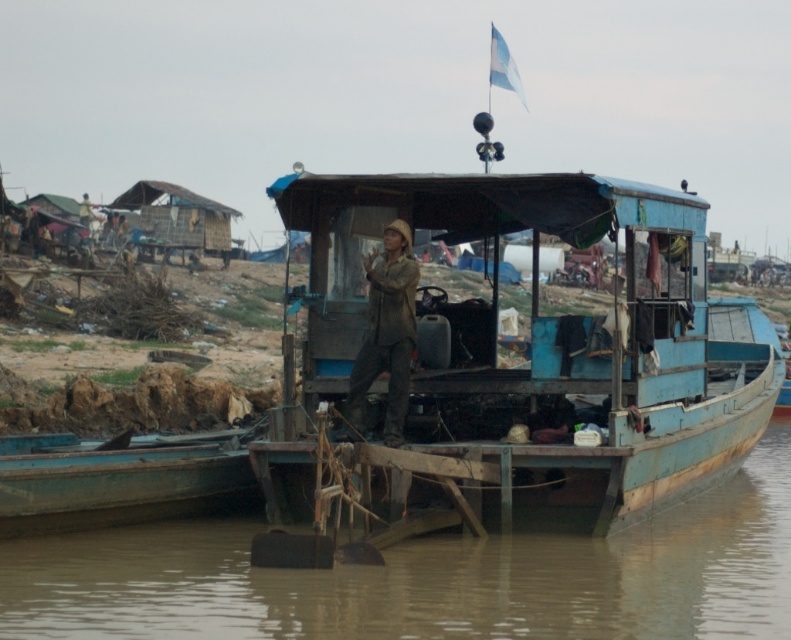
You are navigating a small boat along the river and want to reach the point marked at coordinates (x=430, y=579). Based on the scene, can you determine if this point is located on the brown wooden river at center?

The brown wooden river at center is located at point (x=430, y=579), so yes, the point is on the brown wooden river at center.

You are standing on the wooden boat at lower left and want to reach the brown wooden river at center. Which direction should you move towards?

The brown wooden river at center is positioned on the right side of the wooden boat at lower left, so you should move towards the right to reach it.

From the picture: You are standing at point A and want to reach point B. The coordinates of point A are at (28, 528). The coordinates of point B are at 0.175, 0.963. The distance between them is 15.85 meters. You have a 10 meter long rope. Can you safely cross the river using this rope?

The distance between point A at (28, 528) and point B at 0.175, 0.963 is 15.85 meters. Since the rope is only 10 meters long, it is not long enough to safely cross the river between these two points.